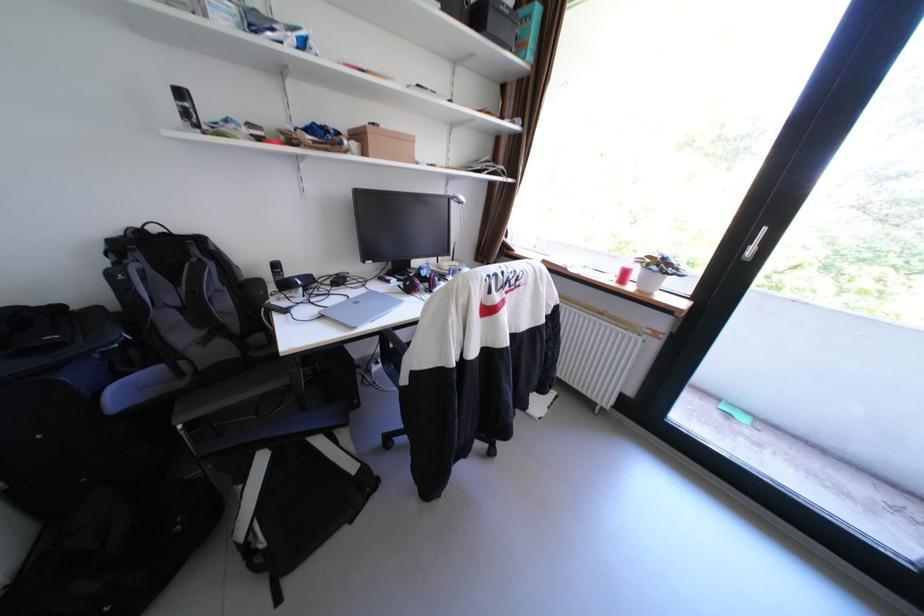
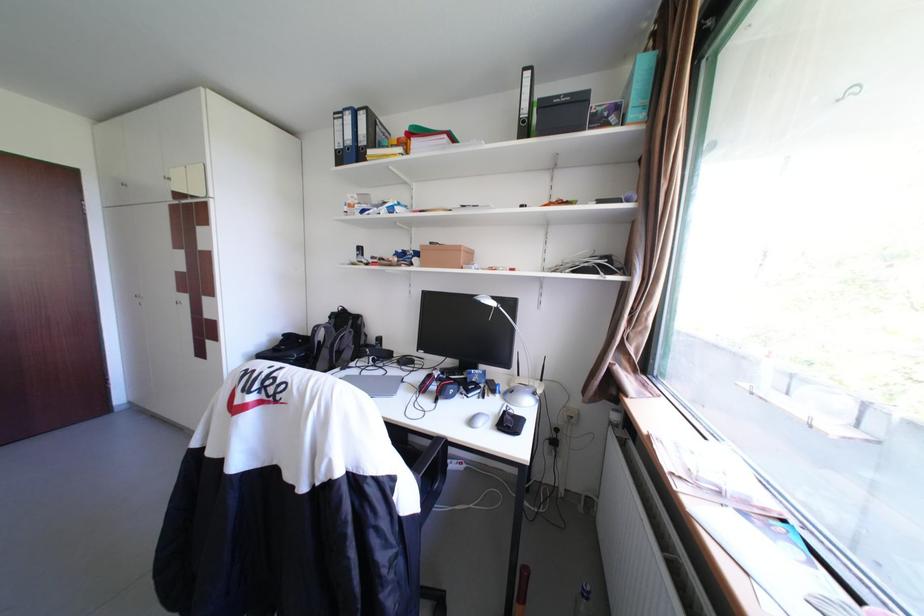
Locate, in the second image, the point that corresponds to the point at 148,256 in the first image.

(344, 321)